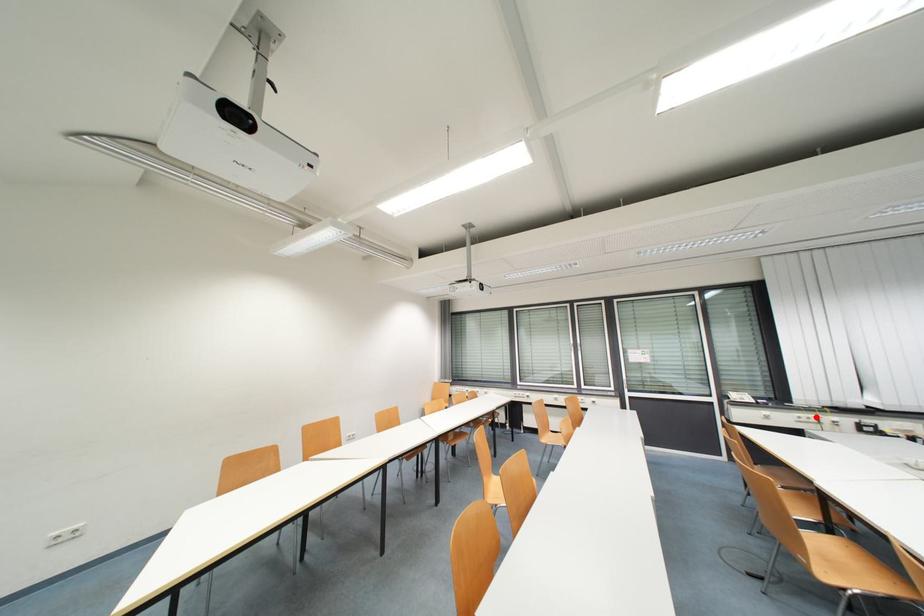
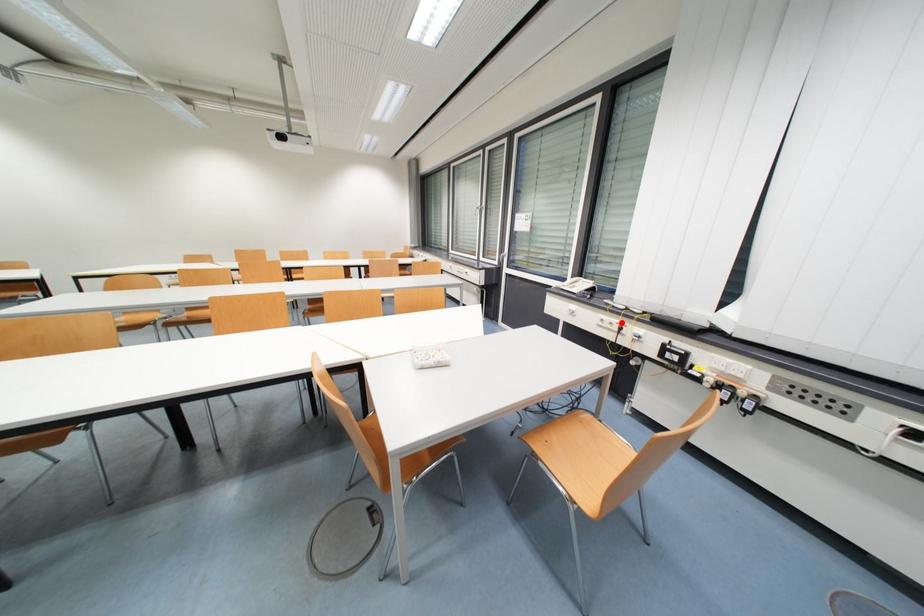
I am providing you with two images of the same scene from different viewpoints. A red point is marked on the first image and another point is marked on the second image. Do the highlighted points in image1 and image2 indicate the same real-world spot?

Yes